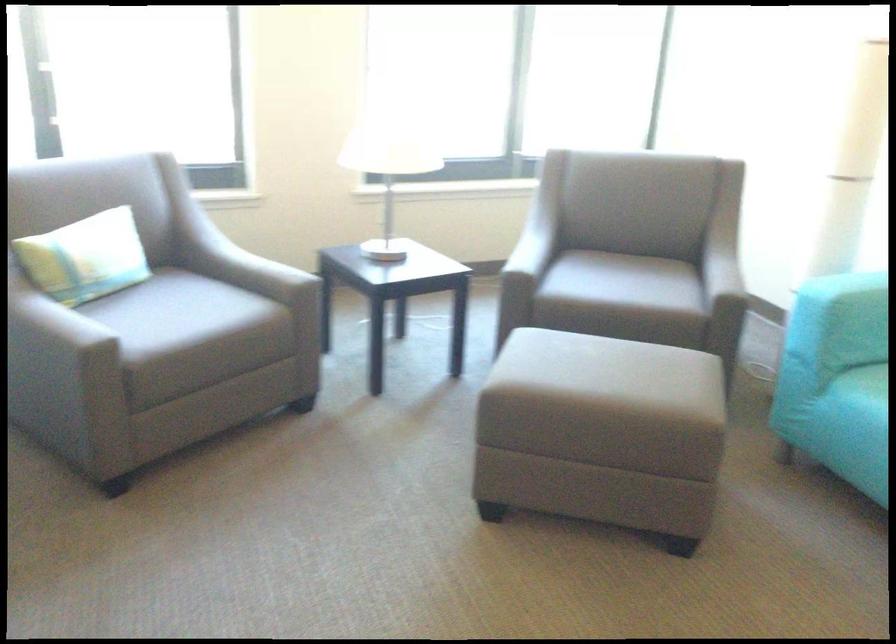
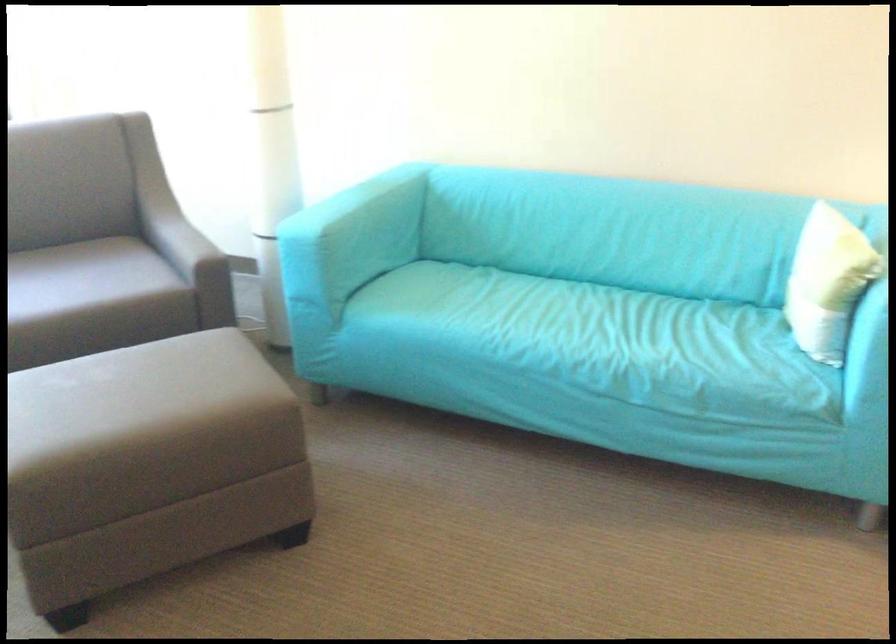
In the second image, find the point that corresponds to (584,421) in the first image.

(149, 464)